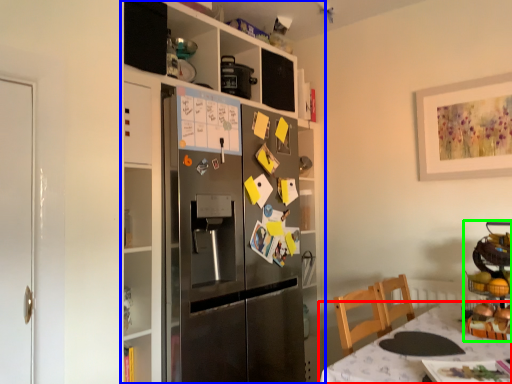
Question: Based on their relative distances, which object is farther from table (highlighted by a red box)? Choose from cabinetry (highlighted by a blue box) and appliance (highlighted by a green box).

Choices:
 (A) cabinetry
 (B) appliance

Answer: (A)